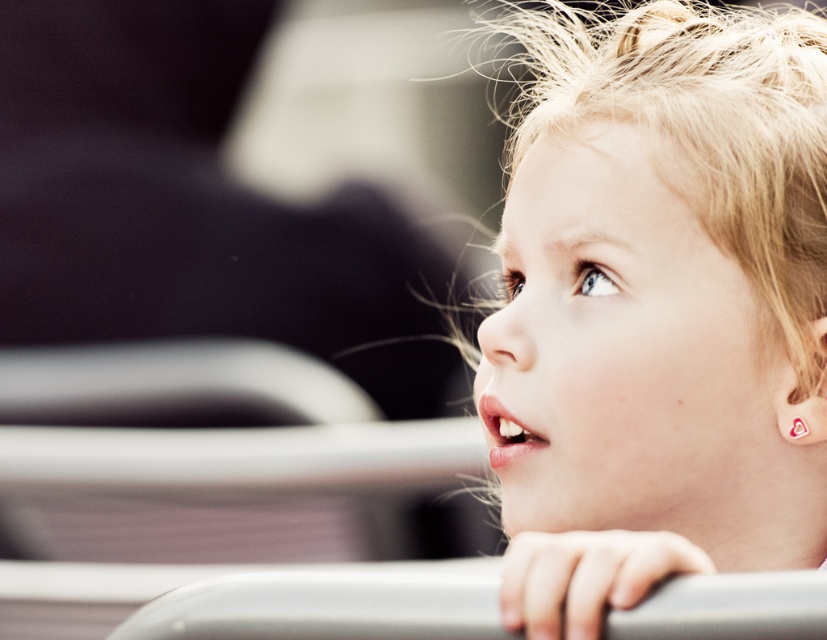
Question: Is pale blonde hair at upper right smaller than gray rubber rail at lower center?

Choices:
 (A) yes
 (B) no

Answer: (B)

Question: Which object is farther from the camera taking this photo?

Choices:
 (A) pale blonde hair at upper right
 (B) gray rubber rail at lower center

Answer: (A)

Question: From the image, what is the correct spatial relationship of pale blonde hair at upper right in relation to gray rubber rail at lower center?

Choices:
 (A) above
 (B) below

Answer: (A)

Question: Considering the relative positions of pale blonde hair at upper right and gray rubber rail at lower center in the image provided, where is pale blonde hair at upper right located with respect to gray rubber rail at lower center?

Choices:
 (A) above
 (B) below

Answer: (A)

Question: Which point is farther from the camera taking this photo?

Choices:
 (A) (491, 589)
 (B) (692, 317)

Answer: (B)

Question: Which object is farther from the camera taking this photo?

Choices:
 (A) gray rubber rail at lower center
 (B) pale blonde hair at upper right

Answer: (B)